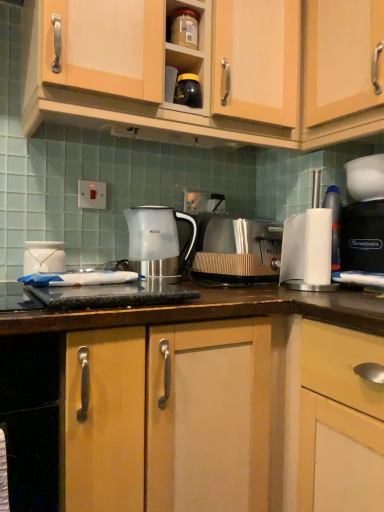
Question: In terms of height, does white glossy jar at left, the second appliance when ordered from right to left, look taller or shorter compared to white paper towel at right?

Choices:
 (A) tall
 (B) short

Answer: (B)

Question: Is white glossy jar at left, the 1th appliance positioned from the left, inside or outside of white paper towel at right?

Choices:
 (A) inside
 (B) outside

Answer: (B)

Question: Based on their relative distances, which object is farther from the metallic silver toaster at center?

Choices:
 (A) black glossy jar at upper center, placed as the first appliance when sorted from right to left
 (B) white paper towel at right
 (C) light wood cabinet at upper right, placed as the 2th cabinetry when sorted from left to right
 (D) matte plastic container at upper center
 (E) black plastic coffee machine at right

Answer: (D)

Question: Which of these objects is positioned farthest from the white paper towel at right?

Choices:
 (A) translucent plastic kettle at center
 (B) white glossy jar at left, the second appliance when ordered from right to left
 (C) light wood cabinet at upper right, placed as the 2th cabinetry when sorted from left to right
 (D) black glossy jar at upper center, which ranks as the second appliance in left-to-right order
 (E) matte plastic container at upper center

Answer: (B)